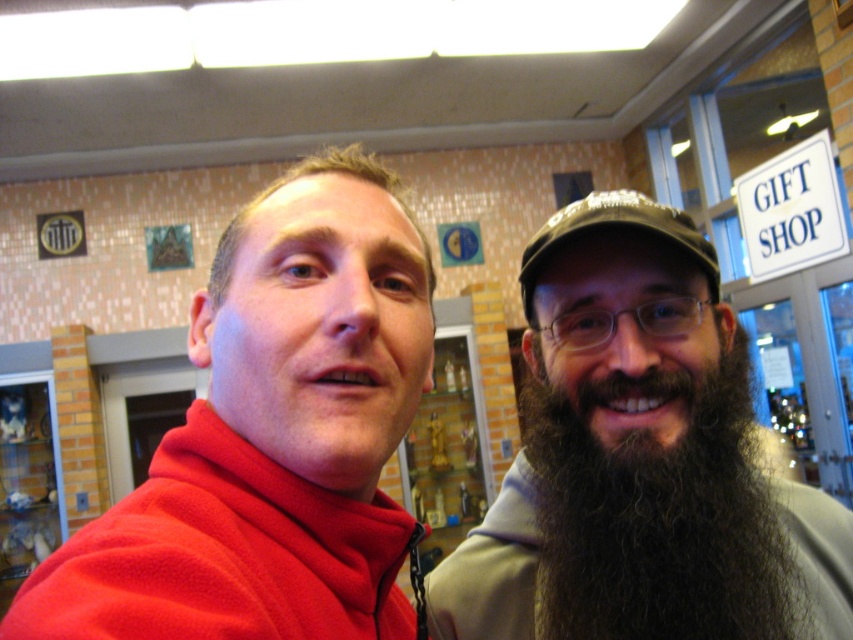
Between matte fleece jacket at upper left and dark brown fuzzy beard at right, which one has less height?

dark brown fuzzy beard at right is shorter.

Is matte fleece jacket at upper left further to camera compared to dark brown fuzzy beard at right?

No, it is not.

What do you see at coordinates (273, 438) in the screenshot?
I see `matte fleece jacket at upper left` at bounding box center [273, 438].

At what (x,y) coordinates should I click in order to perform the action: click on matte fleece jacket at upper left. Please return your answer as a coordinate pair (x, y). The image size is (853, 640). Looking at the image, I should click on (273, 438).

Which of these two, dark brown beard at right or green fabric cap at upper right, stands taller?

Standing taller between the two is dark brown beard at right.

Is dark brown beard at right below green fabric cap at upper right?

Yes, dark brown beard at right is below green fabric cap at upper right.

Between point (741, 456) and point (577, 202), which one is positioned in front?

Point (741, 456)

Where is `dark brown beard at right`? This screenshot has height=640, width=853. dark brown beard at right is located at coordinates (640, 460).

Who is positioned more to the left, matte fleece jacket at upper left or green fabric cap at upper right?

Positioned to the left is matte fleece jacket at upper left.

Between point (112, 630) and point (639, 221), which one is positioned behind?

The point (639, 221) is more distant.

Find the location of `matte fleece jacket at upper left`. matte fleece jacket at upper left is located at coordinates (273, 438).